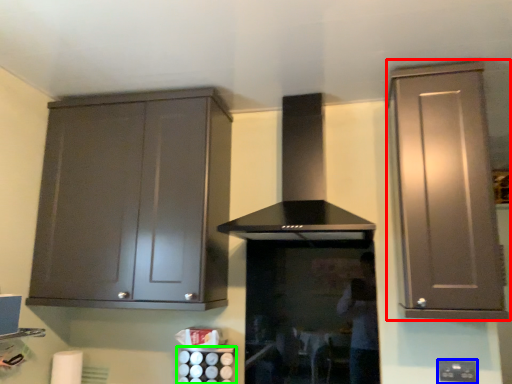
Question: Estimate the real-world distances between objects in this image. Which object is closer to cabinetry (highlighted by a red box), electric outlet (highlighted by a blue box) or appliance (highlighted by a green box)?

Choices:
 (A) electric outlet
 (B) appliance

Answer: (A)